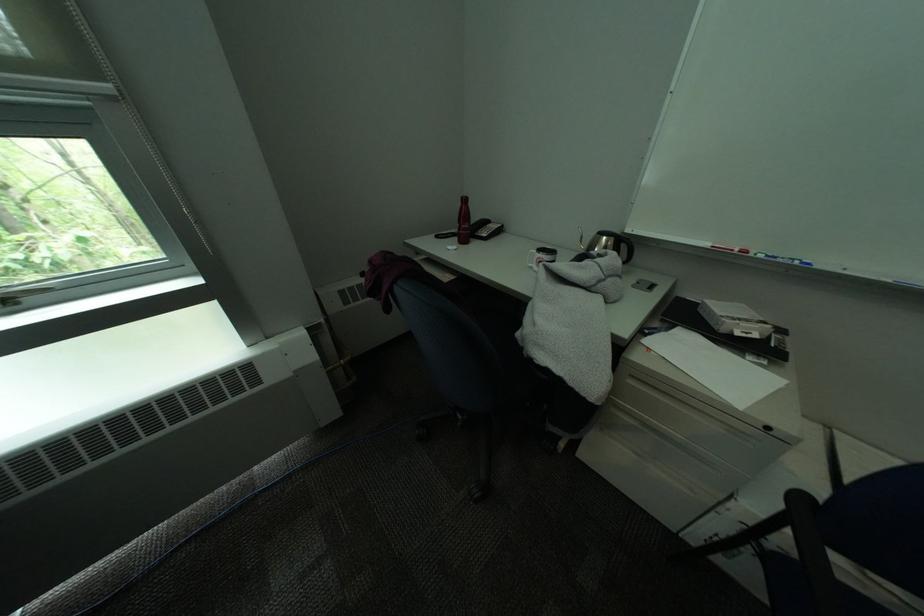
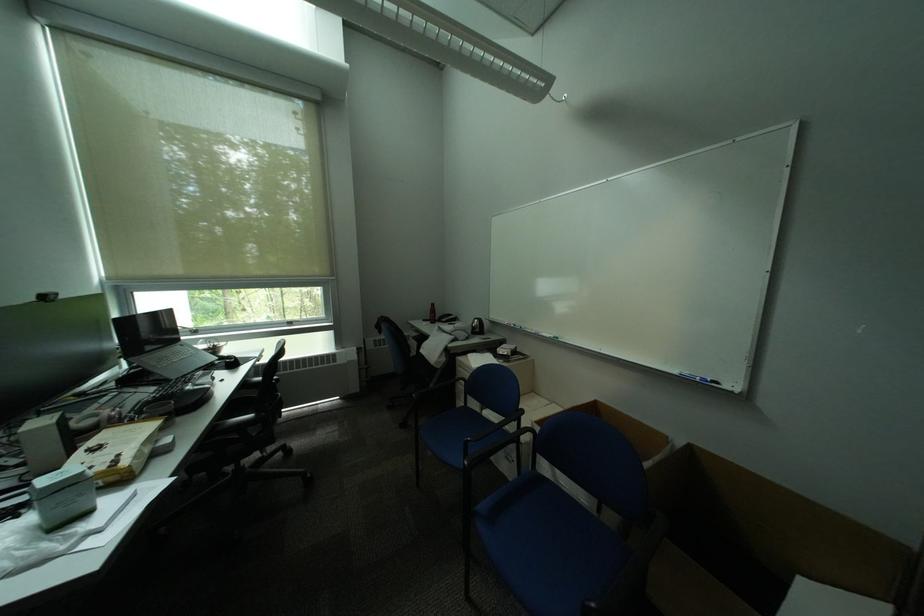
In a continuous first-person perspective shot, in which direction is the camera moving?

The cameraman walked toward right, backward.